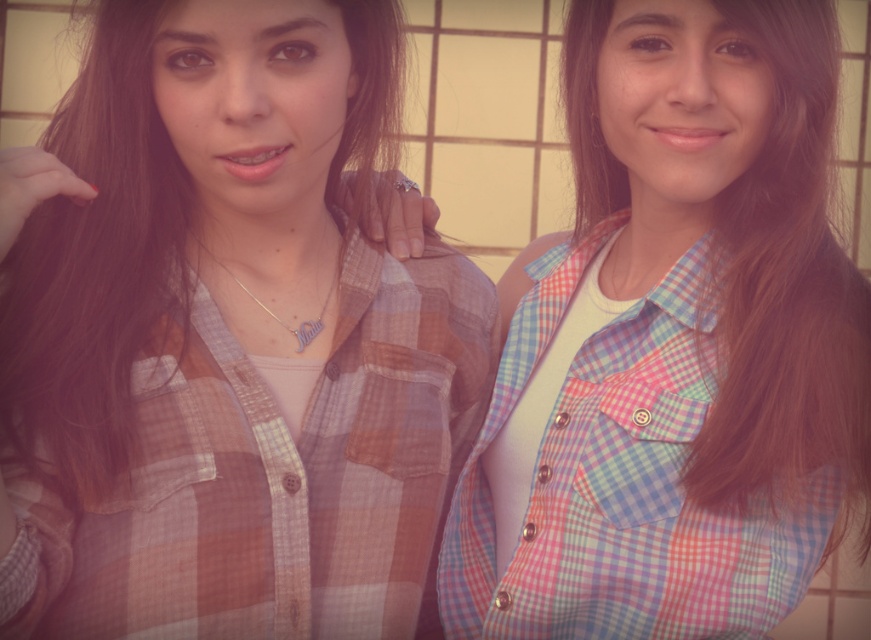
Who is more forward, (741, 371) or (111, 102)?

Point (741, 371) is more forward.

Describe the element at coordinates (787, 292) in the screenshot. I see `brown silky hair at center` at that location.

The height and width of the screenshot is (640, 871). Identify the location of brown silky hair at center. (787, 292).